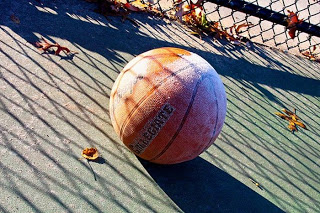
Image resolution: width=320 pixels, height=213 pixels. Find the location of `step`. step is located at coordinates (286, 71).